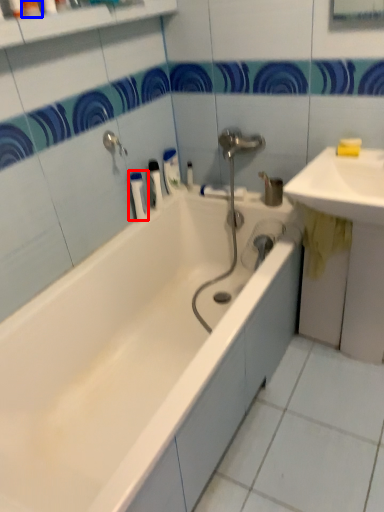
Question: Among these objects, which one is nearest to the camera, toiletry (highlighted by a red box) or toiletry (highlighted by a blue box)?

Choices:
 (A) toiletry
 (B) toiletry

Answer: (B)